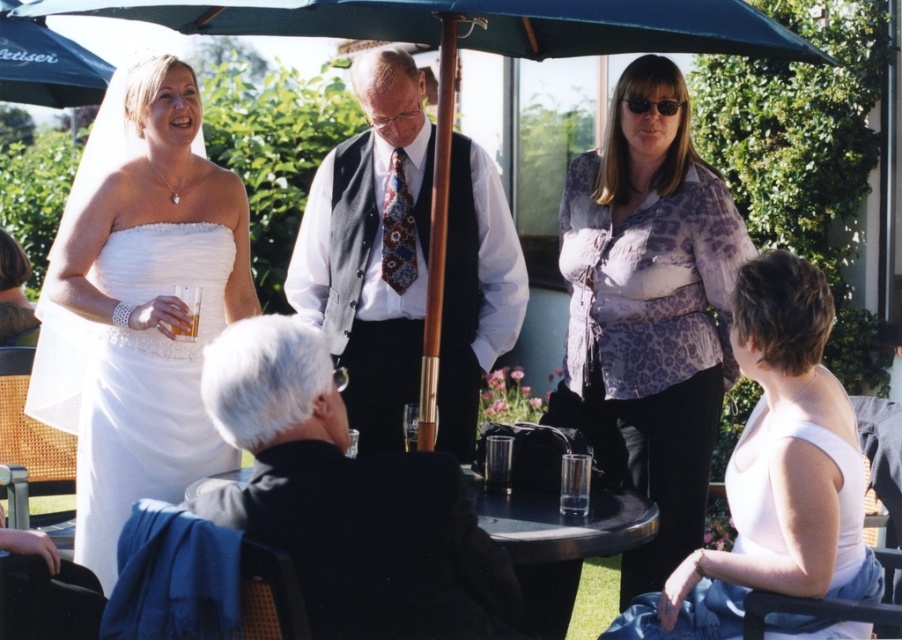
Question: Is printed silk blouse at upper center to the right of white shirt with vest at center from the viewer's perspective?

Choices:
 (A) yes
 (B) no

Answer: (A)

Question: Which of the following is the farthest from the observer?

Choices:
 (A) (226, 464)
 (B) (167, 381)
 (C) (626, 93)
 (D) (785, 516)

Answer: (A)

Question: Is printed silk blouse at upper center smaller than white matte tank top at lower right?

Choices:
 (A) no
 (B) yes

Answer: (A)

Question: Which object is positioned closest to the black wool jacket at lower left?

Choices:
 (A) white satin dress at left
 (B) white shirt with vest at center

Answer: (A)

Question: Is printed silk blouse at upper center closer to camera compared to white satin dress at left?

Choices:
 (A) no
 (B) yes

Answer: (A)

Question: Which of these objects is positioned closest to the printed silk blouse at upper center?

Choices:
 (A) white matte tank top at lower right
 (B) white satin dress at upper left
 (C) white satin dress at left
 (D) white shirt with vest at center

Answer: (D)